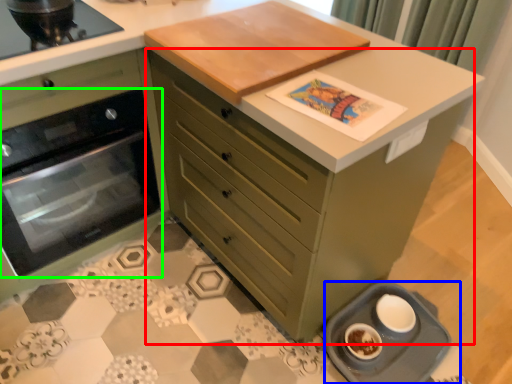
Question: Which is farther away from chest of drawers (highlighted by a red box)? appliance (highlighted by a blue box) or kitchen appliance (highlighted by a green box)?

Choices:
 (A) appliance
 (B) kitchen appliance

Answer: (B)